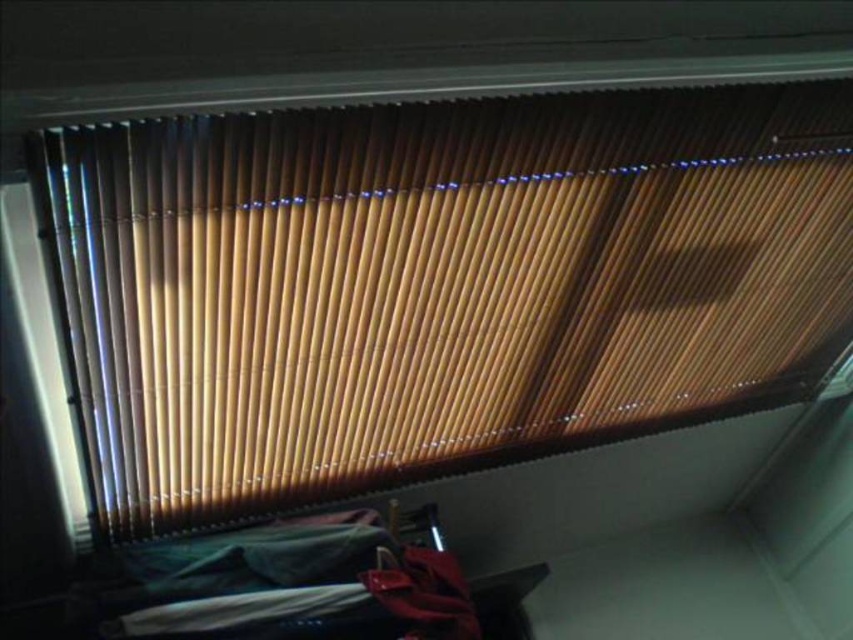
Who is more distant from viewer, (108, 272) or (366, 545)?

The point (366, 545) is behind.

Is wooden blinds at upper center bigger than velvet green bed at lower center?

Indeed, wooden blinds at upper center has a larger size compared to velvet green bed at lower center.

What do you see at coordinates (434, 284) in the screenshot?
I see `wooden blinds at upper center` at bounding box center [434, 284].

This screenshot has height=640, width=853. I want to click on wooden blinds at upper center, so click(434, 284).